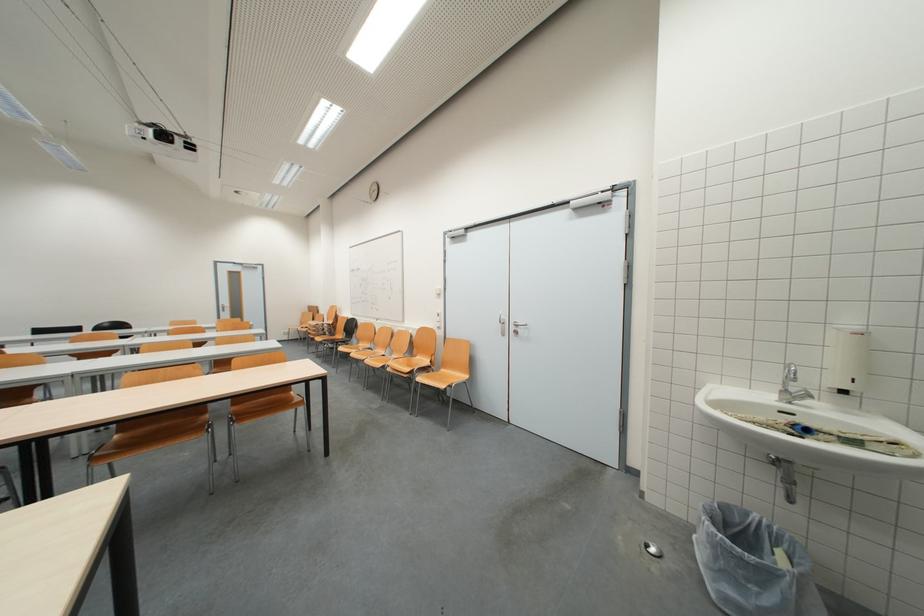
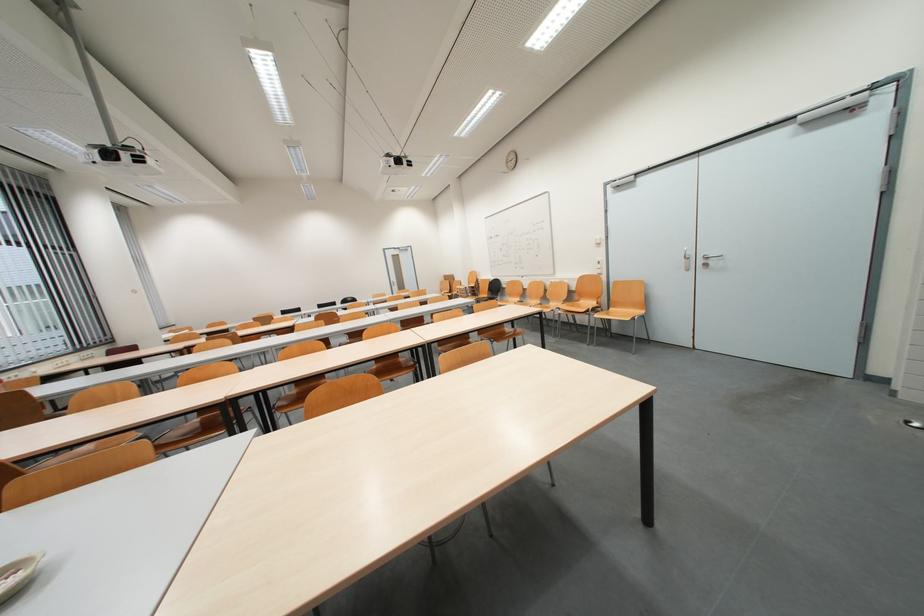
Find the pixel in the second image that matches (421,357) in the first image.

(582, 302)